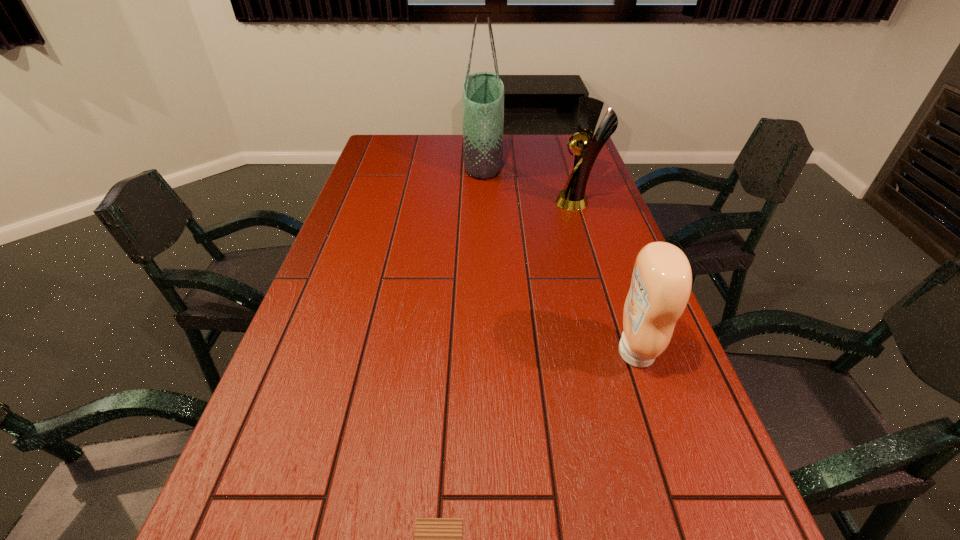
The width and height of the screenshot is (960, 540). What are the coordinates of `free location located 0.100m on the label of the third farthest object` in the screenshot? It's located at (571, 353).

Where is `object that is at the far edge`? Image resolution: width=960 pixels, height=540 pixels. object that is at the far edge is located at coordinates (483, 93).

At what (x,y) coordinates should I click in order to perform the action: click on award that is at the right edge. Please return your answer as a coordinate pair (x, y). Image resolution: width=960 pixels, height=540 pixels. Looking at the image, I should click on (572, 197).

What are the coordinates of `condiment at the right edge` in the screenshot? It's located at [x=661, y=283].

Locate an element on the screen. free space at the left edge of the desktop is located at coordinates (236, 488).

Identify the location of blank space at the right edge. Image resolution: width=960 pixels, height=540 pixels. (674, 369).

Find the location of a particular element. free space between the award and the condiment is located at coordinates click(607, 277).

This screenshot has height=540, width=960. Identify the location of unoccupied position between the second nearest object and the second farthest object. (607, 277).

Find the location of a particular element. The width and height of the screenshot is (960, 540). vacant region between the tote bag and the second nearest object is located at coordinates (559, 256).

Find the location of `object that can be found as the closest to the third nearest object`. object that can be found as the closest to the third nearest object is located at coordinates (483, 93).